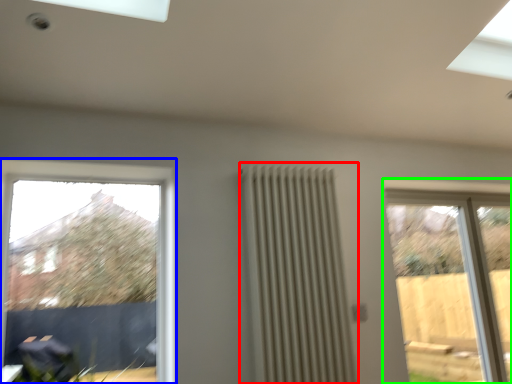
Question: Which object is positioned closest to radiator (highlighted by a red box)? Select from window (highlighted by a blue box) and window (highlighted by a green box).

Choices:
 (A) window
 (B) window

Answer: (A)